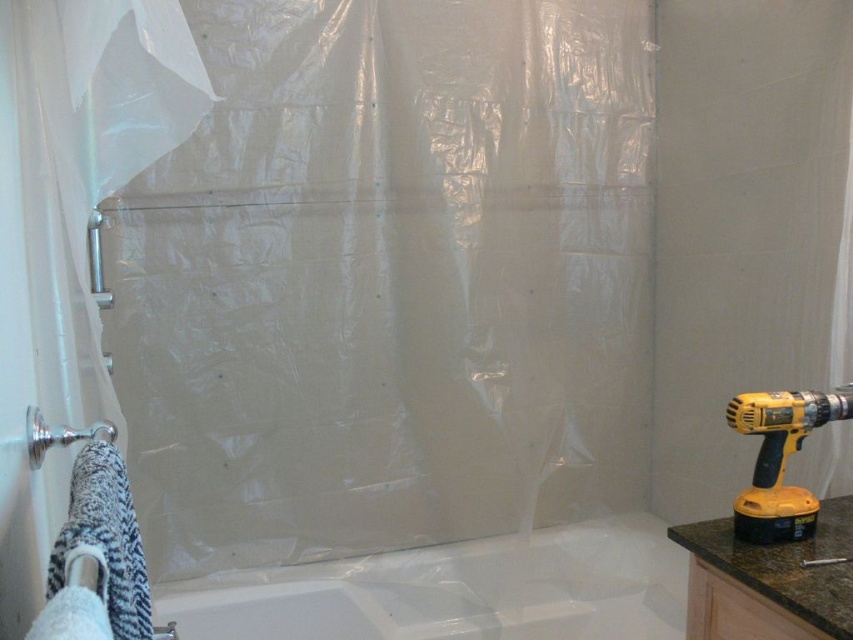
Question: Does transparent plastic shower curtain at upper center have a smaller size compared to white glossy sink at lower center?

Choices:
 (A) no
 (B) yes

Answer: (A)

Question: Does transparent plastic shower curtain at upper center appear on the right side of brushed metal towel bar at left?

Choices:
 (A) no
 (B) yes

Answer: (B)

Question: Which point appears farthest from the camera in this image?

Choices:
 (A) (334, 579)
 (B) (109, 440)
 (C) (694, 605)
 (D) (436, 445)

Answer: (D)

Question: Which of the following is the farthest from the observer?

Choices:
 (A) (822, 563)
 (B) (102, 548)

Answer: (A)

Question: Is granite countertop at lower right smaller than yellow/black cordless drill at right?

Choices:
 (A) no
 (B) yes

Answer: (A)

Question: Among these objects, which one is farthest from the camera?

Choices:
 (A) white fabric towel bar at left
 (B) transparent plastic shower curtain at upper center
 (C) yellow plastic drill at right

Answer: (B)